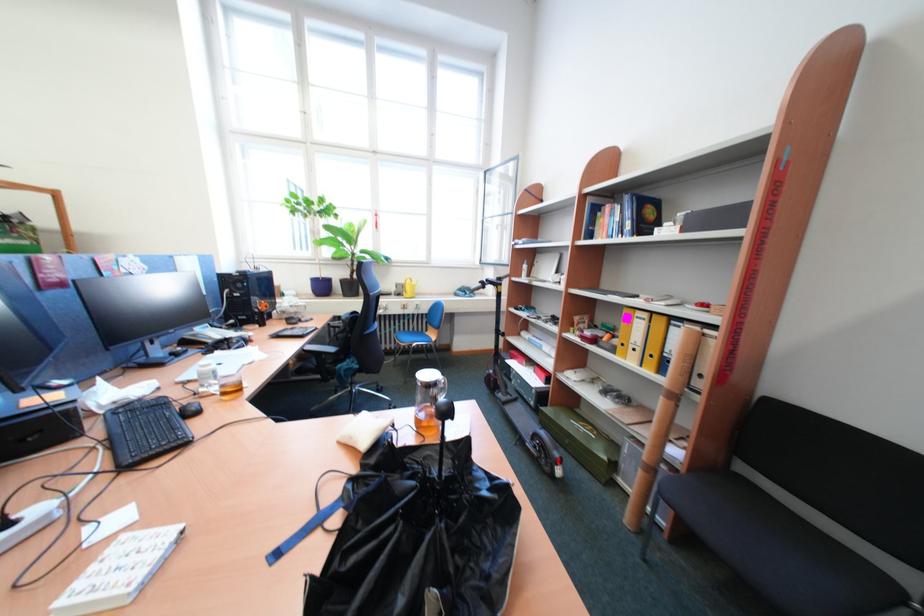
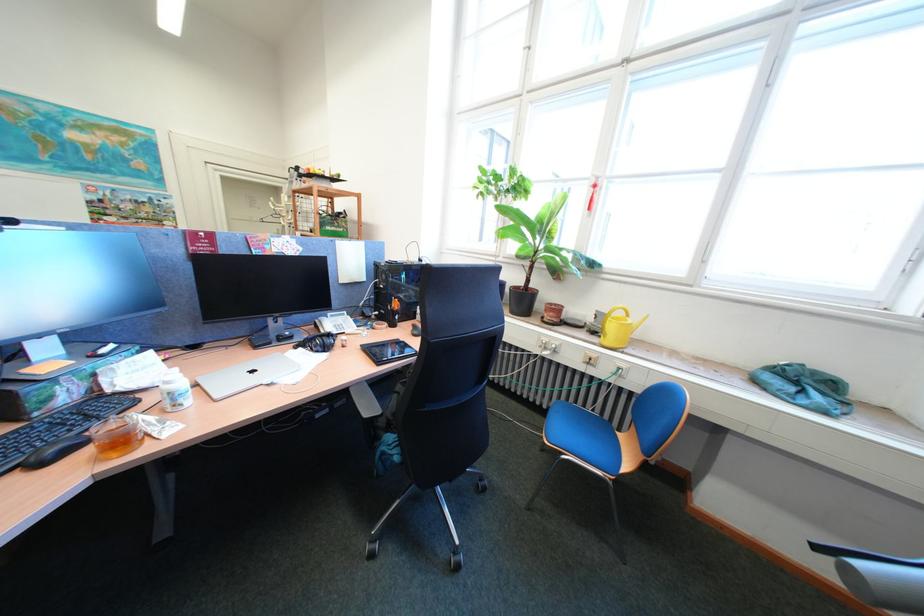
Locate, in the second image, the point that corresponds to (231,354) in the first image.

(313, 351)